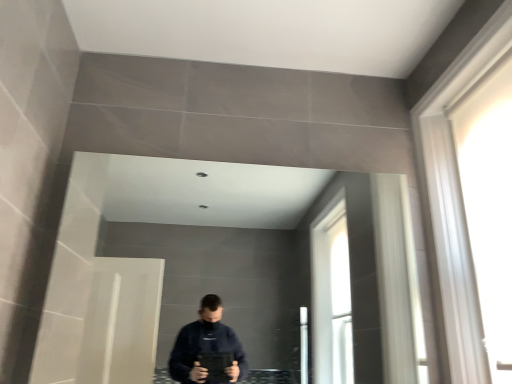
In order to face white glossy door at right, should I rotate leftwards or rightwards?

Turn right approximately 31.685 degrees to face it.

The height and width of the screenshot is (384, 512). Describe the element at coordinates (489, 202) in the screenshot. I see `white glossy door at right` at that location.

Where is `white glossy door at right`? This screenshot has height=384, width=512. white glossy door at right is located at coordinates (489, 202).

Locate an element on the screen. The height and width of the screenshot is (384, 512). white glossy door at right is located at coordinates (489, 202).